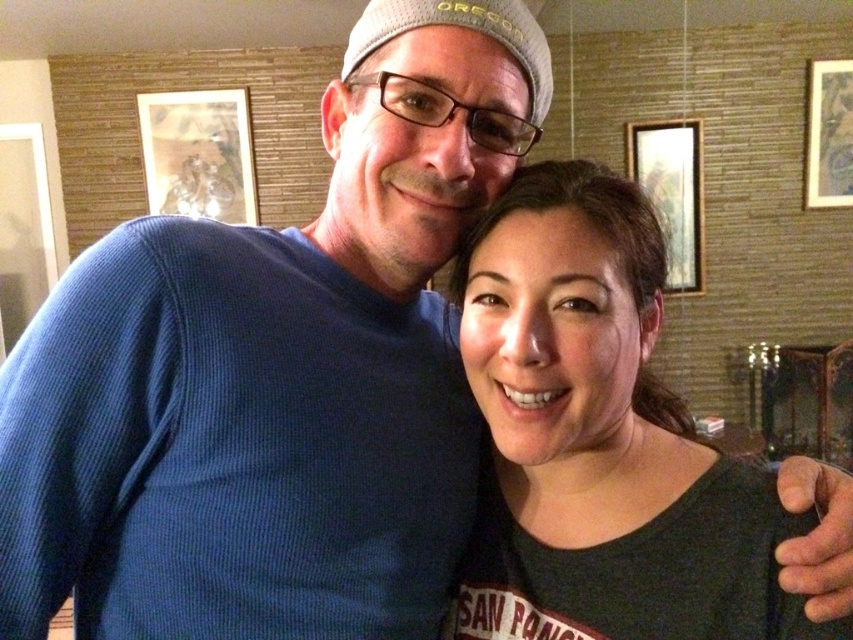
You are an interior designer assessing the wall space between two windows. You notice the wooden frame at upper left and wooden picture frame at upper right. Which frame has a greater width?

The wooden frame at upper left is wider than the wooden picture frame at upper right according to the description.

You are standing in the room and want to hang a new picture exactly where the wooden frame at upper left is currently located. What are the coordinates of the spot where you need to place the new picture?

The coordinates for the wooden frame at upper left are at point (199, 154).

Consider the image. You are a painter who wants to hang a new painting that is 4 feet wide between the wooden frame at upper left and the wooden picture frame at upper right. Can you fit it there?

The wooden frame at upper left and wooden picture frame at upper right are 8.77 feet apart from each other. Since the new painting is 4 feet wide, it can fit between them as there is enough space.